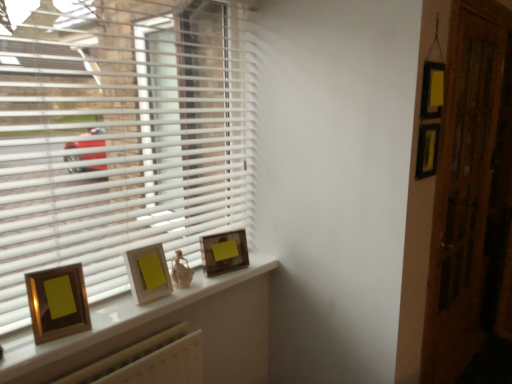
Where is `blank space situated above gold-framed picture at center (from a real-world perspective)`? The width and height of the screenshot is (512, 384). blank space situated above gold-framed picture at center (from a real-world perspective) is located at coordinates (146, 299).